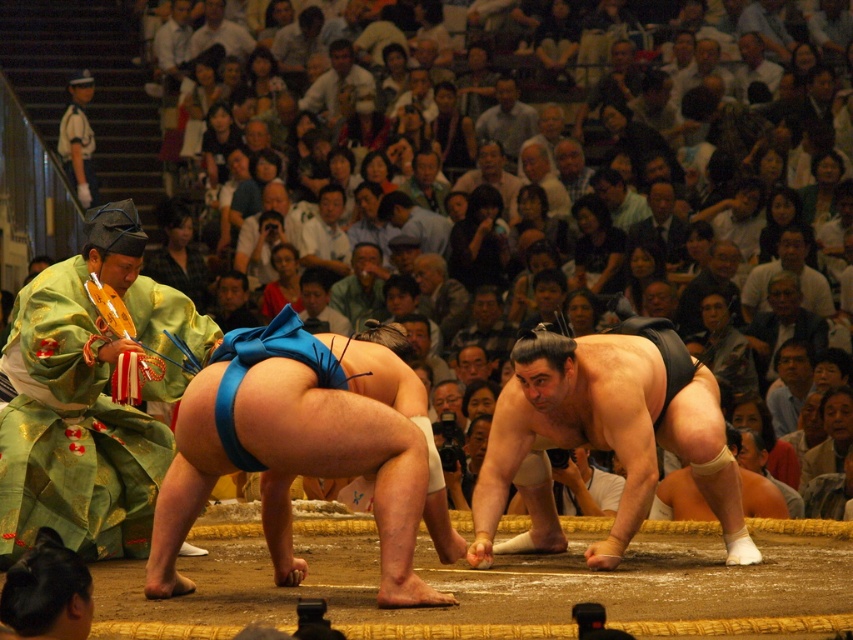
Question: Which object is farther from the camera taking this photo?

Choices:
 (A) white uniform at upper left
 (B) light brown hair at center
 (C) blue fabric sumo at center
 (D) dark gray hair at center

Answer: (B)

Question: Does green silk kimono at left have a lesser width compared to white uniform at upper left?

Choices:
 (A) yes
 (B) no

Answer: (B)

Question: Which object is farther from the camera taking this photo?

Choices:
 (A) white uniform at upper left
 (B) dark gray hair at center

Answer: (B)

Question: From the image, what is the correct spatial relationship of blue fabric sumo at center in relation to dark gray hair at center?

Choices:
 (A) above
 (B) below

Answer: (B)

Question: Can you confirm if black matte sumo wrestler at center is bigger than light brown hair at center?

Choices:
 (A) yes
 (B) no

Answer: (A)

Question: Which of the following is the closest to the observer?

Choices:
 (A) click(x=364, y=81)
 (B) click(x=128, y=326)
 (C) click(x=512, y=109)

Answer: (B)